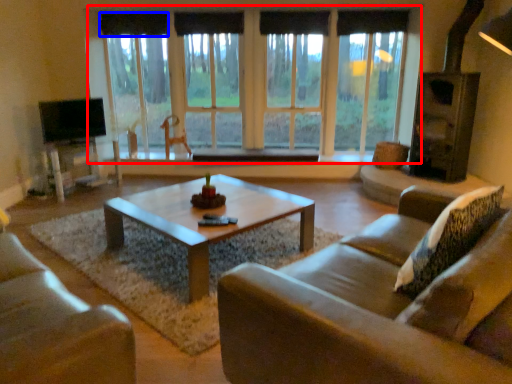
Question: Which object is closer to the camera taking this photo, window (highlighted by a red box) or curtain (highlighted by a blue box)?

Choices:
 (A) window
 (B) curtain

Answer: (A)